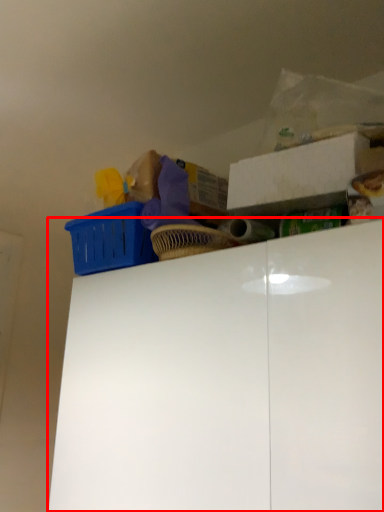
Question: From the image's perspective, considering the relative positions of cabinetry (annotated by the red box) and storage box in the image provided, where is cabinetry (annotated by the red box) located with respect to the staircase?

Choices:
 (A) below
 (B) above

Answer: (A)